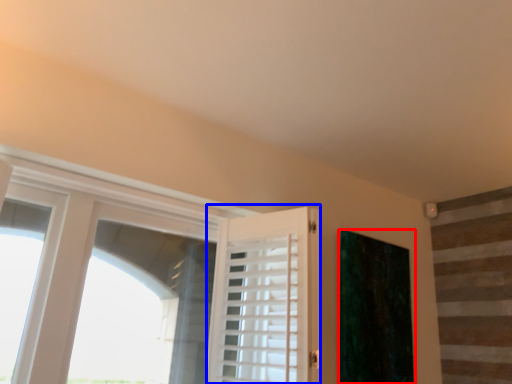
Question: Which object appears farthest to the camera in this image, curtain (highlighted by a red box) or barn door (highlighted by a blue box)?

Choices:
 (A) curtain
 (B) barn door

Answer: (A)